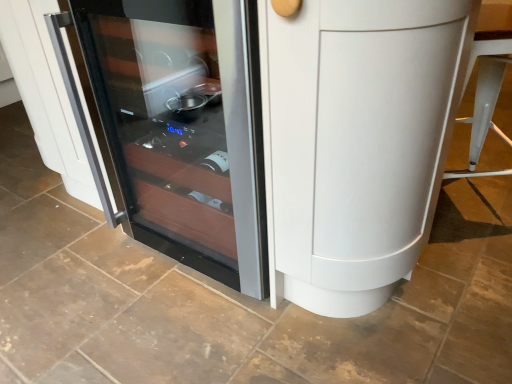
Locate an element on the screen. This screenshot has height=384, width=512. satin white wine cooler at center is located at coordinates (277, 135).

What do you see at coordinates (277, 135) in the screenshot? Image resolution: width=512 pixels, height=384 pixels. I see `satin white wine cooler at center` at bounding box center [277, 135].

At what (x,y) coordinates should I click in order to perform the action: click on satin white wine cooler at center. Please return your answer as a coordinate pair (x, y). The height and width of the screenshot is (384, 512). Looking at the image, I should click on (277, 135).